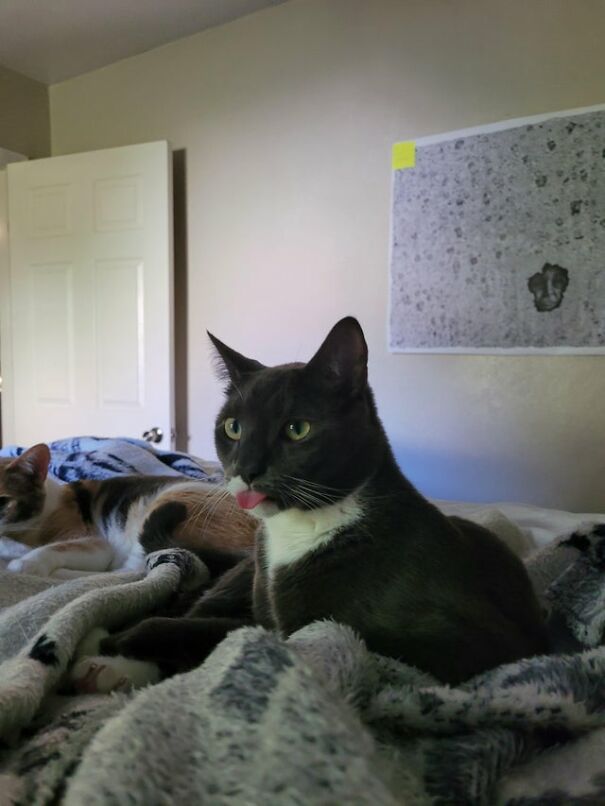
Image resolution: width=605 pixels, height=806 pixels. Find the location of `door`. door is located at coordinates (85, 366).